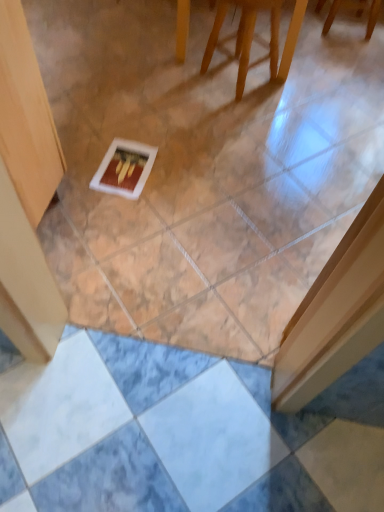
Find the location of a particular element. This screenshot has width=384, height=512. space that is in front of wooden chair at upper center, the second furniture ordered from the bottom is located at coordinates (331, 52).